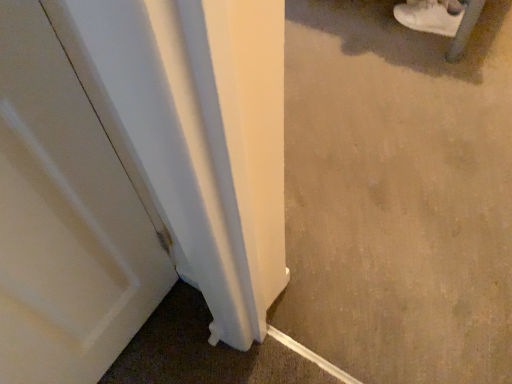
The width and height of the screenshot is (512, 384). What do you see at coordinates (430, 16) in the screenshot?
I see `white suede shoe at upper right` at bounding box center [430, 16].

The width and height of the screenshot is (512, 384). Identify the location of white suede shoe at upper right. (430, 16).

What do you see at coordinates (398, 194) in the screenshot?
I see `beige carpet at lower right` at bounding box center [398, 194].

The height and width of the screenshot is (384, 512). Find the location of `beige carpet at lower right`. beige carpet at lower right is located at coordinates (398, 194).

At what (x,y) coordinates should I click in order to perform the action: click on white suede shoe at upper right. Please return your answer as a coordinate pair (x, y). This screenshot has width=512, height=384. Looking at the image, I should click on (430, 16).

Considering the positions of objects white suede shoe at upper right and beige carpet at lower right in the image provided, who is more to the left, white suede shoe at upper right or beige carpet at lower right?

Positioned to the left is beige carpet at lower right.

Is white suede shoe at upper right further to camera compared to beige carpet at lower right?

Yes, white suede shoe at upper right is behind beige carpet at lower right.

Is point (426, 10) closer to camera compared to point (459, 104)?

No.

From the image's perspective, would you say white suede shoe at upper right is shown under beige carpet at lower right?

No, from the image's perspective, white suede shoe at upper right is not beneath beige carpet at lower right.

From a real-world perspective, who is located higher, white suede shoe at upper right or beige carpet at lower right?

beige carpet at lower right, from a real-world perspective.

Considering the sizes of white suede shoe at upper right and beige carpet at lower right in the image, is white suede shoe at upper right wider or thinner than beige carpet at lower right?

In the image, white suede shoe at upper right appears to be more narrow than beige carpet at lower right.

In terms of height, does white suede shoe at upper right look taller or shorter compared to beige carpet at lower right?

Clearly, white suede shoe at upper right is shorter compared to beige carpet at lower right.

Can you confirm if white suede shoe at upper right is bigger than beige carpet at lower right?

No.

Does white suede shoe at upper right contain beige carpet at lower right?

No, white suede shoe at upper right does not contain beige carpet at lower right.

Is white suede shoe at upper right touching beige carpet at lower right?

They are not placed beside each other.

Is white suede shoe at upper right turned away from beige carpet at lower right?

white suede shoe at upper right is not turned away from beige carpet at lower right.

Can you tell me how much white suede shoe at upper right and beige carpet at lower right differ in facing direction?

The angle between the facing direction of white suede shoe at upper right and the facing direction of beige carpet at lower right is 3.14 degrees.

In the scene shown: How distant is white suede shoe at upper right from beige carpet at lower right?

The distance of white suede shoe at upper right from beige carpet at lower right is 22.27 inches.

Locate an element on the screen. The height and width of the screenshot is (384, 512). footwear on the right side of beige carpet at lower right is located at coordinates (430, 16).

From the picture: Considering the positions of objects beige carpet at lower right and white suede shoe at upper right in the image provided, who is more to the left, beige carpet at lower right or white suede shoe at upper right?

beige carpet at lower right is more to the left.

Which object is further away from the camera, beige carpet at lower right or white suede shoe at upper right?

white suede shoe at upper right is further from the camera.

Is point (466, 331) closer or farther from the camera than point (410, 13)?

Point (466, 331).

Based on the photo, from the image's perspective, who appears lower, beige carpet at lower right or white suede shoe at upper right?

From the image's view, beige carpet at lower right is below.

From a real-world perspective, who is located higher, beige carpet at lower right or white suede shoe at upper right?

beige carpet at lower right is physically above.

Considering the relative sizes of beige carpet at lower right and white suede shoe at upper right in the image provided, is beige carpet at lower right wider than white suede shoe at upper right?

Yes.

Between beige carpet at lower right and white suede shoe at upper right, which one has less height?

white suede shoe at upper right is shorter.

Is beige carpet at lower right bigger or smaller than white suede shoe at upper right?

Considering their sizes, beige carpet at lower right takes up more space than white suede shoe at upper right.

Choose the correct answer: Is beige carpet at lower right inside white suede shoe at upper right or outside it?

beige carpet at lower right lies outside white suede shoe at upper right.

Would you consider beige carpet at lower right to be distant from white suede shoe at upper right?

No, beige carpet at lower right is not far from white suede shoe at upper right.

Does beige carpet at lower right turn towards white suede shoe at upper right?

No, beige carpet at lower right is not aimed at white suede shoe at upper right.

From the picture: Can you tell me how much beige carpet at lower right and white suede shoe at upper right differ in facing direction?

3.14 degrees.

Measure the distance from beige carpet at lower right to white suede shoe at upper right.

beige carpet at lower right is 22.27 inches away from white suede shoe at upper right.

Where is `concrete in front of the white suede shoe at upper right`? The height and width of the screenshot is (384, 512). concrete in front of the white suede shoe at upper right is located at coordinates (398, 194).

The width and height of the screenshot is (512, 384). Find the location of `concrete on the left of white suede shoe at upper right`. concrete on the left of white suede shoe at upper right is located at coordinates (398, 194).

Image resolution: width=512 pixels, height=384 pixels. I want to click on concrete below the white suede shoe at upper right (from the image's perspective), so click(398, 194).